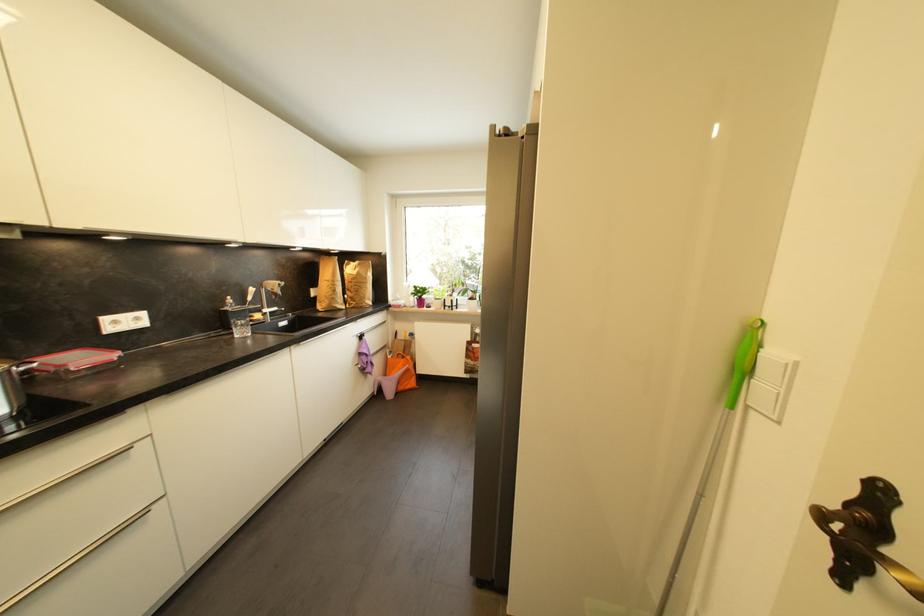
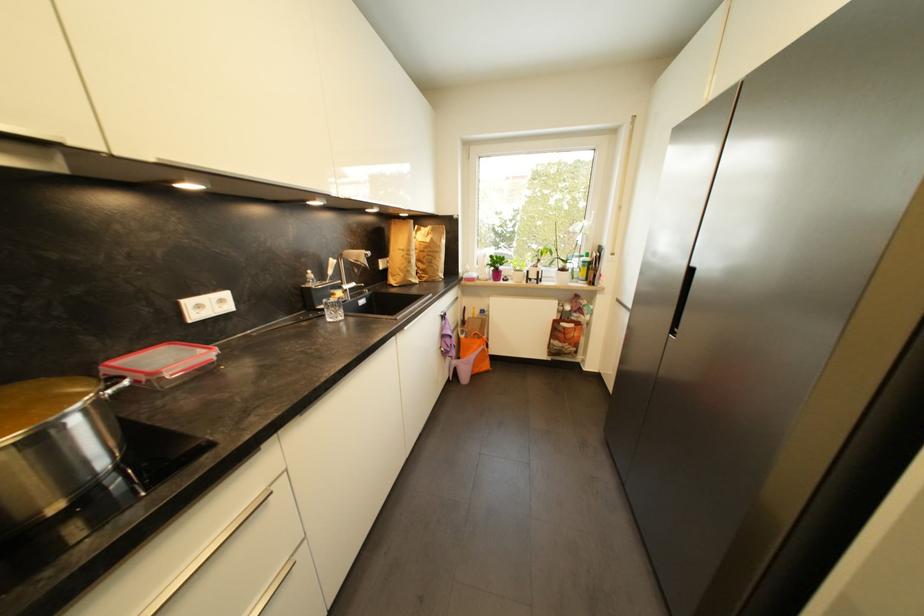
The point at (68,367) is marked in the first image. Where is the corresponding point in the second image?

(162, 375)